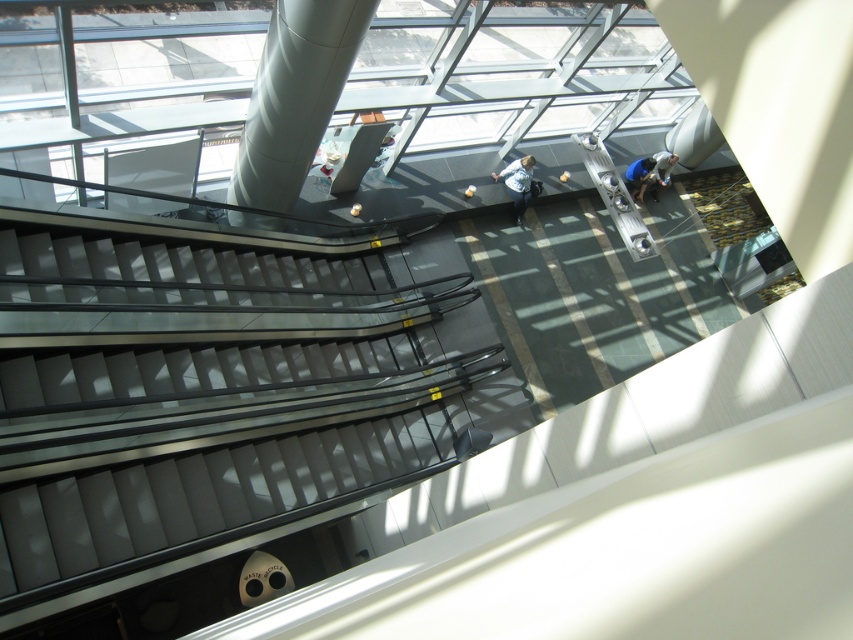
You are standing in the atrium and need to reach the light blue denim jacket at center. The satin silver column at center is in your way. If you can move around the column, how far will you have to walk to reach the jacket?

The satin silver column at center is 3.66 meters away from the light blue denim jacket at center. To go around the column, you would need to walk approximately 3.66 meters plus the extra distance required to navigate around the column, depending on its circumference.

You are standing at the entrance of the atrium and want to locate the satin silver column at center. According to the coordinate system where the bottom left corner is the origin, can you determine its position?

The satin silver column at center is located at coordinate point (x=294, y=97).

You are navigating through the atrium and need to reach a specific location. There are two points marked in the scene, point 1 at coordinates [289,72] and point 2 at [666,150]. If you are standing at point 1, which direction should you move to get closer to point 2?

Since point 1 is in front of point 2, you should move backward to get closer to point 2.